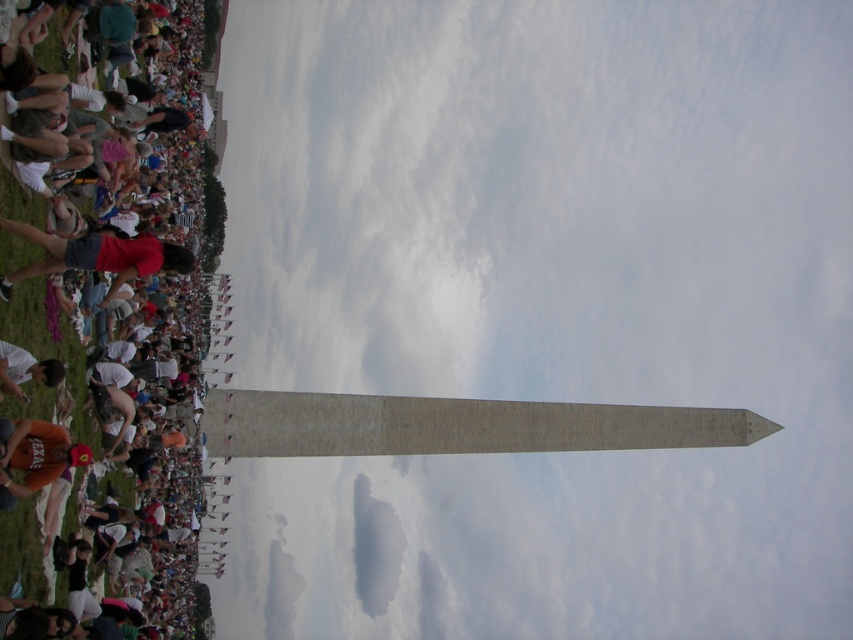
Based on the photo, you are standing at the base of the Washington Monument and want to walk to a specific location. There are two points of interest marked on the ground in front of you. The first is at point (10, 291) and the second is at point (33, 376). Which point is closer to you?

Point (10, 291) is in front of point (33, 376), so the first point is closer to you.